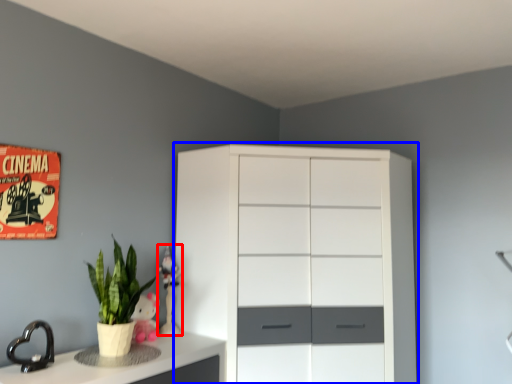
Question: Which of the following is the farthest to the observer, toy (highlighted by a red box) or chest of drawers (highlighted by a blue box)?

Choices:
 (A) toy
 (B) chest of drawers

Answer: (A)